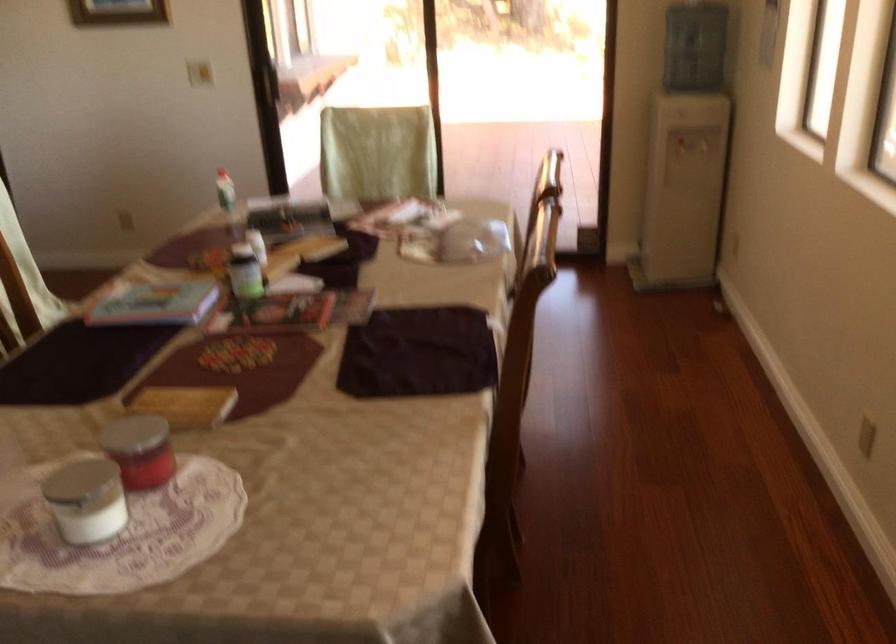
What do you see at coordinates (85, 500) in the screenshot? I see `a white jar lid` at bounding box center [85, 500].